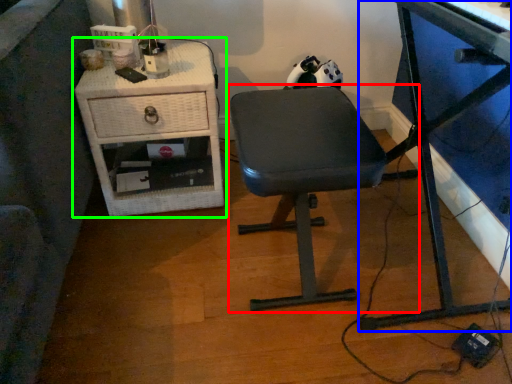
Question: Based on their relative distances, which object is farther from chair (highlighted by a red box)? Choose from desk (highlighted by a blue box) and nightstand (highlighted by a green box).

Choices:
 (A) desk
 (B) nightstand

Answer: (B)